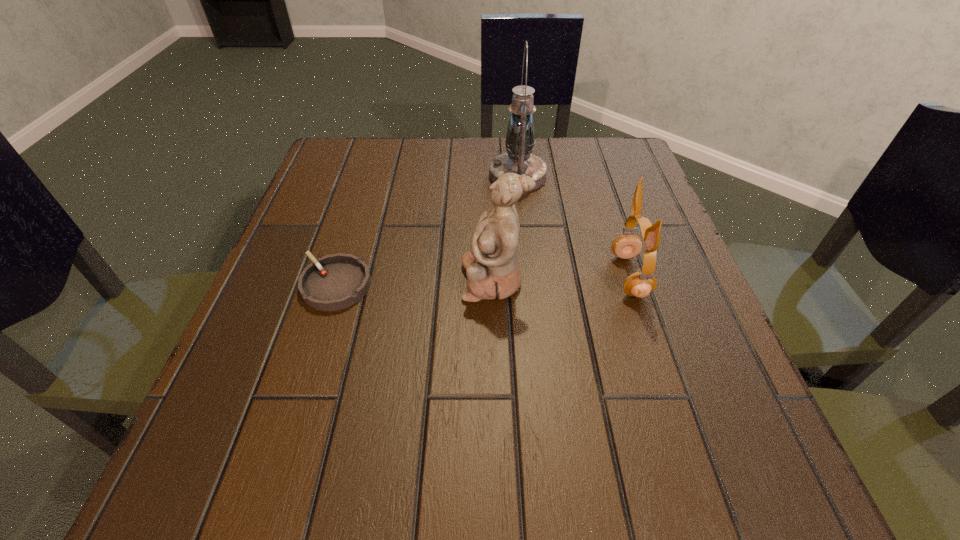
Locate an element on the screen. oil lamp is located at coordinates (519, 159).

Where is `the tallest object`? the tallest object is located at coordinates (519, 159).

Image resolution: width=960 pixels, height=540 pixels. In order to click on figurine in this screenshot , I will do click(492, 269).

In order to click on the second shortest object in this screenshot , I will do `click(640, 284)`.

The height and width of the screenshot is (540, 960). What are the coordinates of `earphone` in the screenshot? It's located at (640, 284).

The height and width of the screenshot is (540, 960). In order to click on ashtray in this screenshot , I will do `click(334, 282)`.

The height and width of the screenshot is (540, 960). In order to click on the leftmost object in this screenshot , I will do `click(334, 282)`.

Find the location of a particular element. free space located on the front of the farthest object is located at coordinates (534, 331).

Locate an element on the screen. Image resolution: width=960 pixels, height=540 pixels. free region located on the front-facing side of the figurine is located at coordinates (415, 280).

Where is `free space located on the front-facing side of the figurine`? free space located on the front-facing side of the figurine is located at coordinates [311, 280].